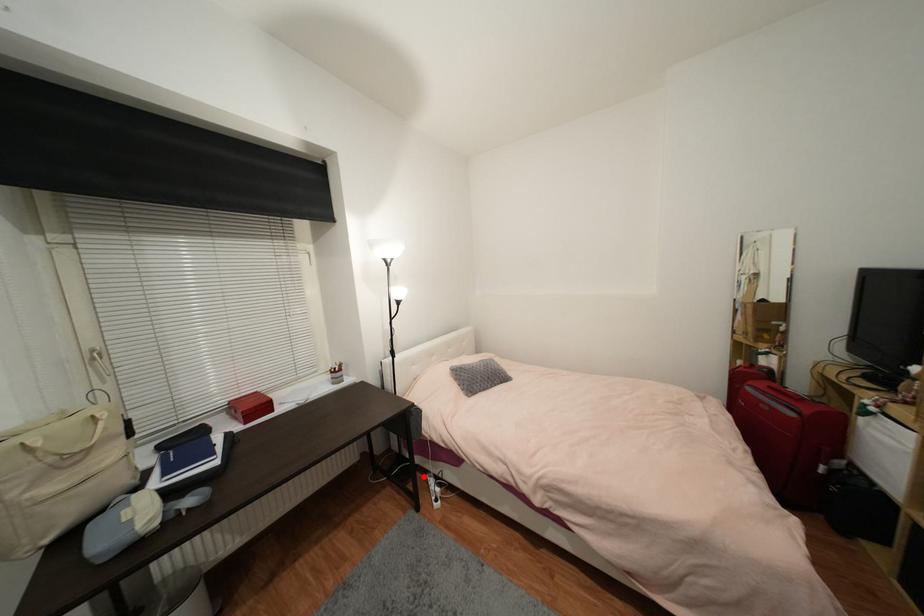
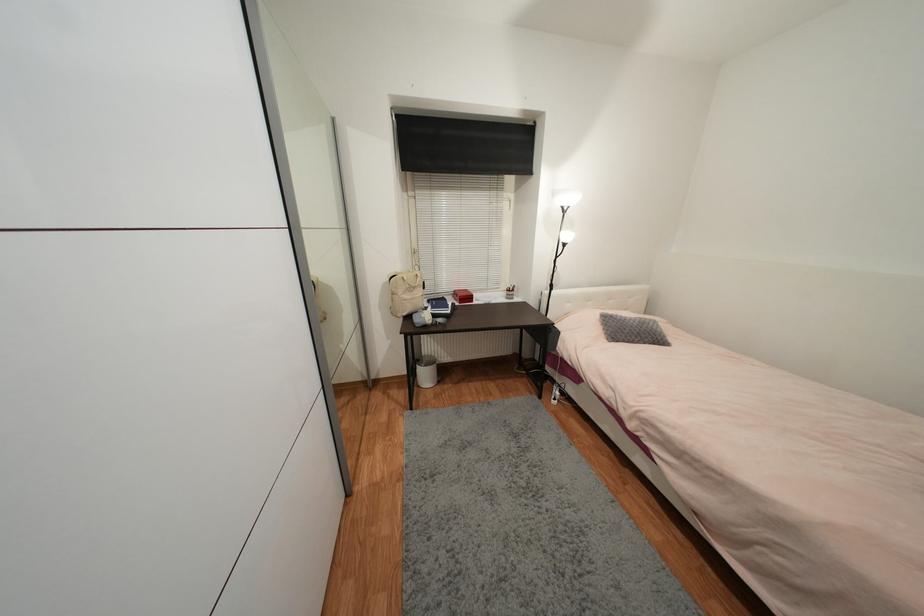
In the second image, find the point that corresponds to the highlighted location in the first image.

(553, 383)